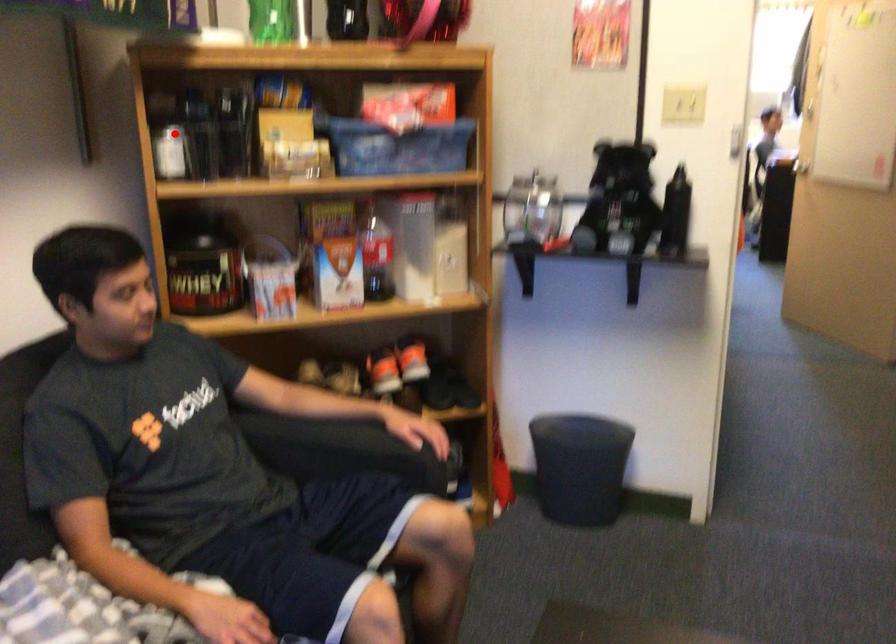
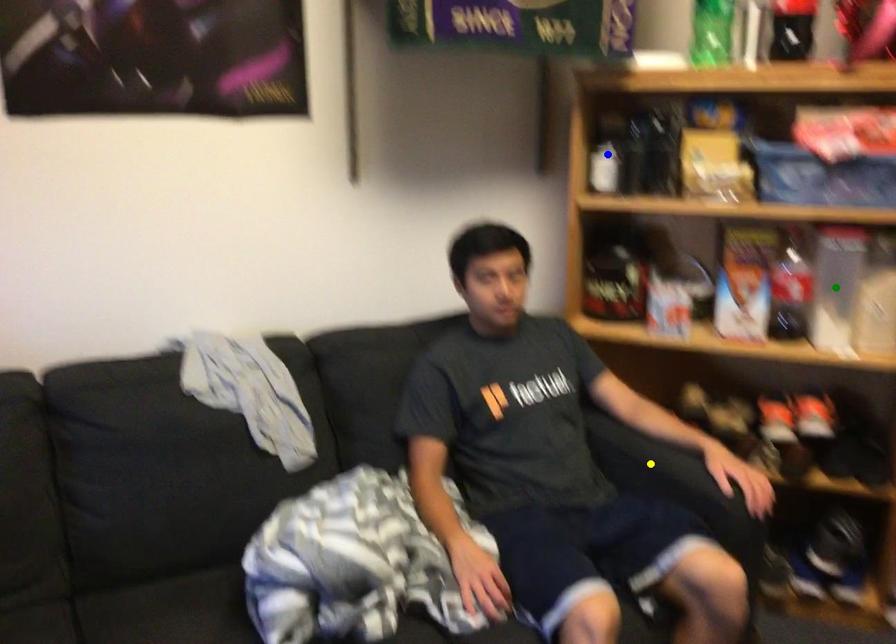
Question: I am providing you with two images of the same scene from different viewpoints. A red point is marked on the first image. You are given multiple points on the second image. Which spot in image 2 lines up with the point in image 1?

Choices:
 (A) green point
 (B) blue point
 (C) yellow point

Answer: (B)